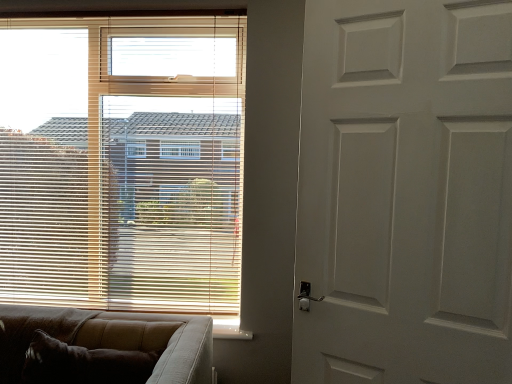
Question: Is the position of white matte door at right more distant than that of brown textured couch at lower left?

Choices:
 (A) yes
 (B) no

Answer: (B)

Question: Can you confirm if white matte door at right is bigger than brown textured couch at lower left?

Choices:
 (A) yes
 (B) no

Answer: (B)

Question: Is white matte door at right oriented away from brown textured couch at lower left?

Choices:
 (A) no
 (B) yes

Answer: (A)

Question: Considering the relative sizes of white matte door at right and brown textured couch at lower left in the image provided, is white matte door at right thinner than brown textured couch at lower left?

Choices:
 (A) yes
 (B) no

Answer: (A)

Question: From the image's perspective, is white matte door at right on top of brown textured couch at lower left?

Choices:
 (A) no
 (B) yes

Answer: (B)

Question: Does white matte door at right appear on the right side of brown textured couch at lower left?

Choices:
 (A) yes
 (B) no

Answer: (A)

Question: Would you say white matte door at right contains wooden blinds at upper left?

Choices:
 (A) no
 (B) yes

Answer: (A)

Question: From a real-world perspective, is white matte door at right on wooden blinds at upper left?

Choices:
 (A) no
 (B) yes

Answer: (A)

Question: Can you confirm if white matte door at right is positioned to the right of wooden blinds at upper left?

Choices:
 (A) no
 (B) yes

Answer: (B)

Question: Is white matte door at right facing away from wooden blinds at upper left?

Choices:
 (A) no
 (B) yes

Answer: (A)

Question: From the image's perspective, is white matte door at right located beneath wooden blinds at upper left?

Choices:
 (A) yes
 (B) no

Answer: (A)

Question: Are white matte door at right and wooden blinds at upper left beside each other?

Choices:
 (A) yes
 (B) no

Answer: (B)

Question: Is brown textured couch at lower left thinner than white matte door at right?

Choices:
 (A) yes
 (B) no

Answer: (B)